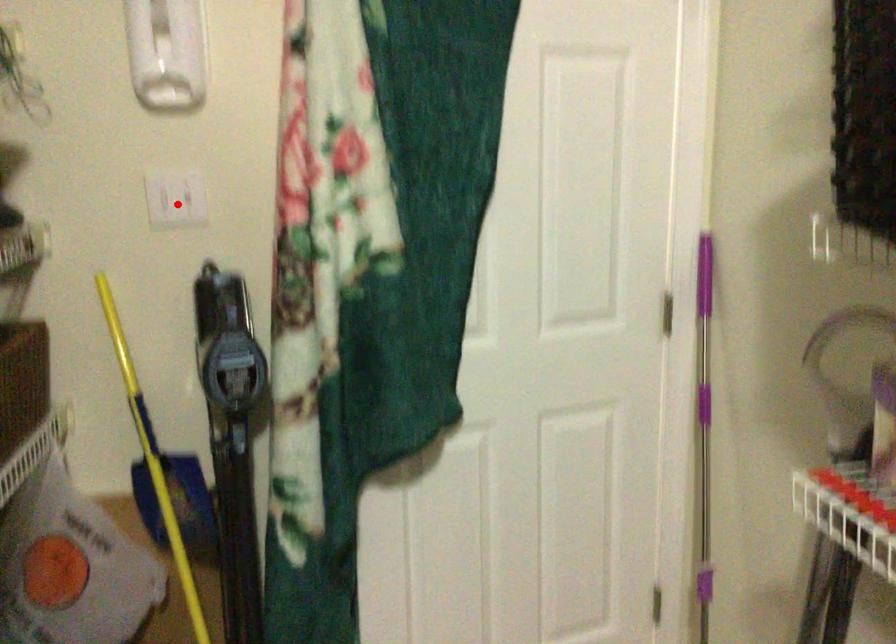
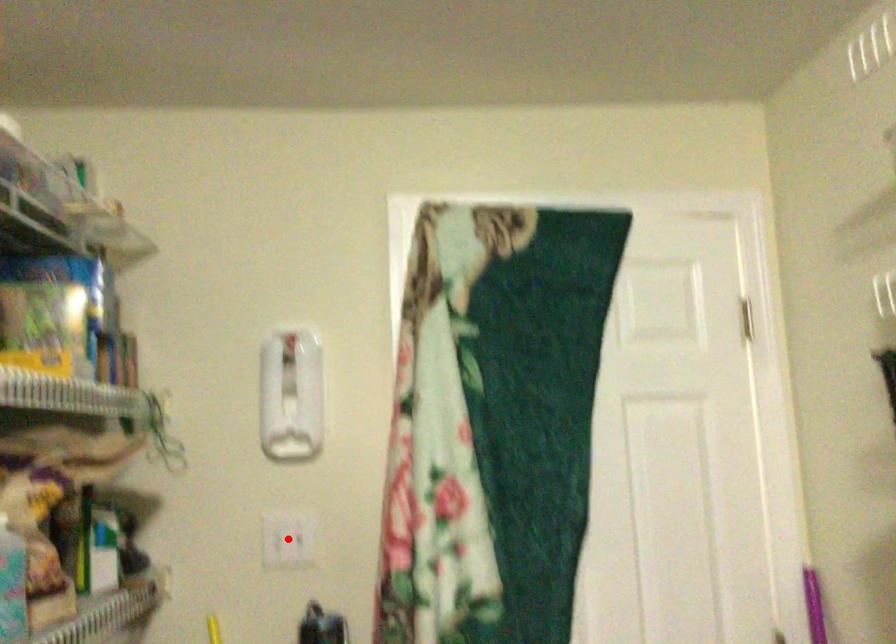
I am providing you with two images of the same scene from different viewpoints. A red point is marked on the first image and another point is marked on the second image. Are the points marked in image1 and image2 representing the same 3D position?

Yes